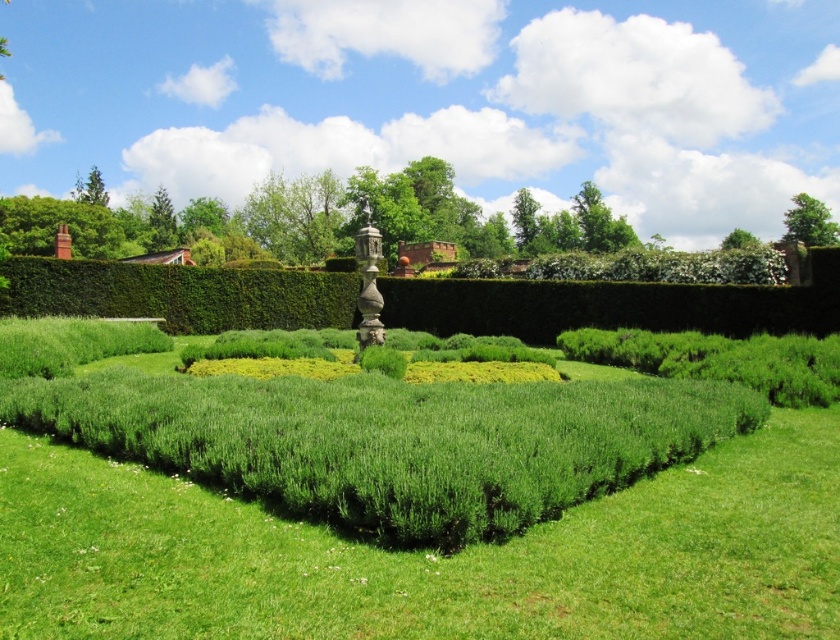
Question: Can you confirm if green soft grass at center is positioned above green leafy bush at upper right?

Choices:
 (A) yes
 (B) no

Answer: (B)

Question: Which of the following is the farthest from the observer?

Choices:
 (A) green soft grass at center
 (B) green leafy bush at upper right

Answer: (B)

Question: Does green soft grass at center appear under green leafy bush at upper right?

Choices:
 (A) yes
 (B) no

Answer: (A)

Question: Does green soft grass at center have a greater width compared to green leafy bush at upper right?

Choices:
 (A) no
 (B) yes

Answer: (A)